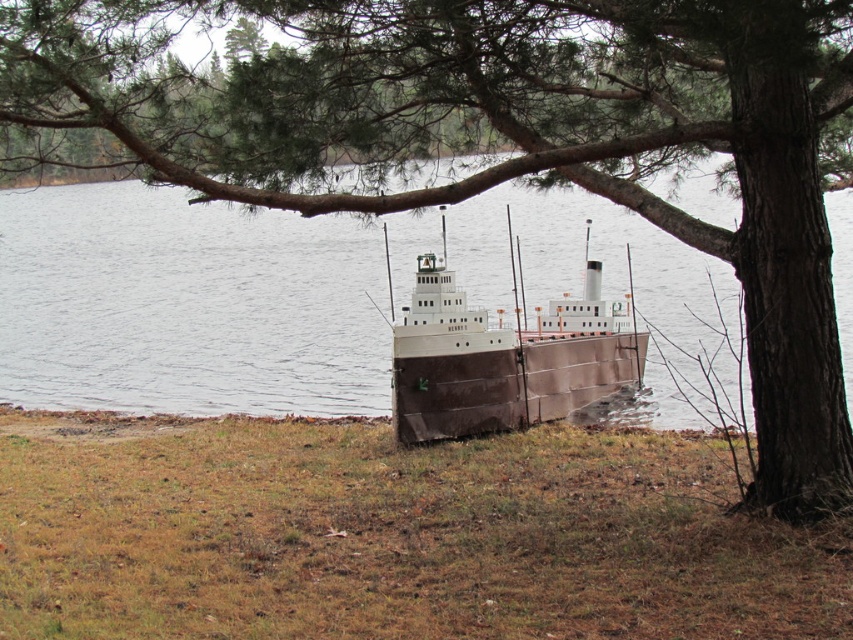
Question: Which point is farther from the camera taking this photo?

Choices:
 (A) (431, 275)
 (B) (431, 632)

Answer: (A)

Question: Is brown grass at lower center to the right of brown matte ship at center from the viewer's perspective?

Choices:
 (A) yes
 (B) no

Answer: (B)

Question: Does brown grass at lower center have a larger size compared to brown matte ship at center?

Choices:
 (A) yes
 (B) no

Answer: (A)

Question: Which object is closer to the camera taking this photo?

Choices:
 (A) brown matte ship at center
 (B) brown grass at lower center

Answer: (B)

Question: Can you confirm if brown grass at lower center is thinner than brown matte ship at center?

Choices:
 (A) yes
 (B) no

Answer: (B)